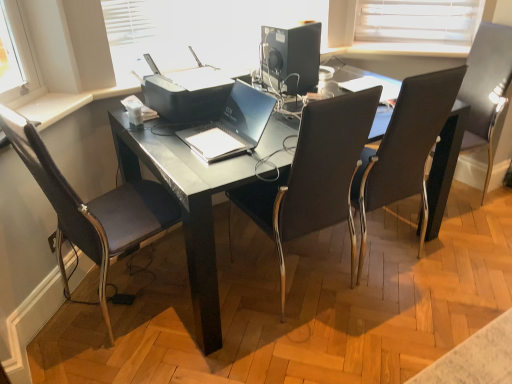
The image size is (512, 384). In order to click on vacant area in front of satin black laptop at center in this screenshot , I will do `click(214, 164)`.